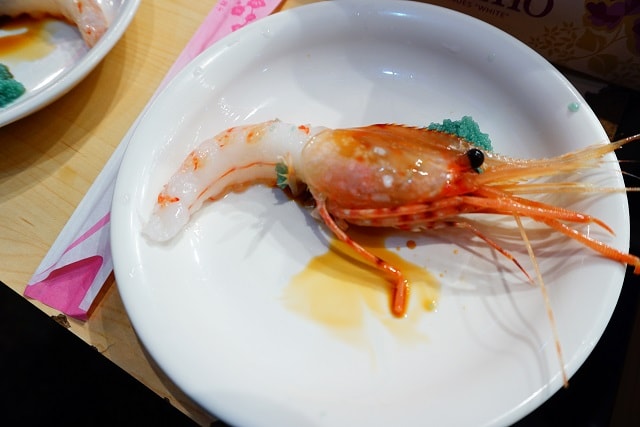
Where is `spot of turquoise that wasn't cleaned off on the plate on the right`? The width and height of the screenshot is (640, 427). spot of turquoise that wasn't cleaned off on the plate on the right is located at coordinates (570, 109).